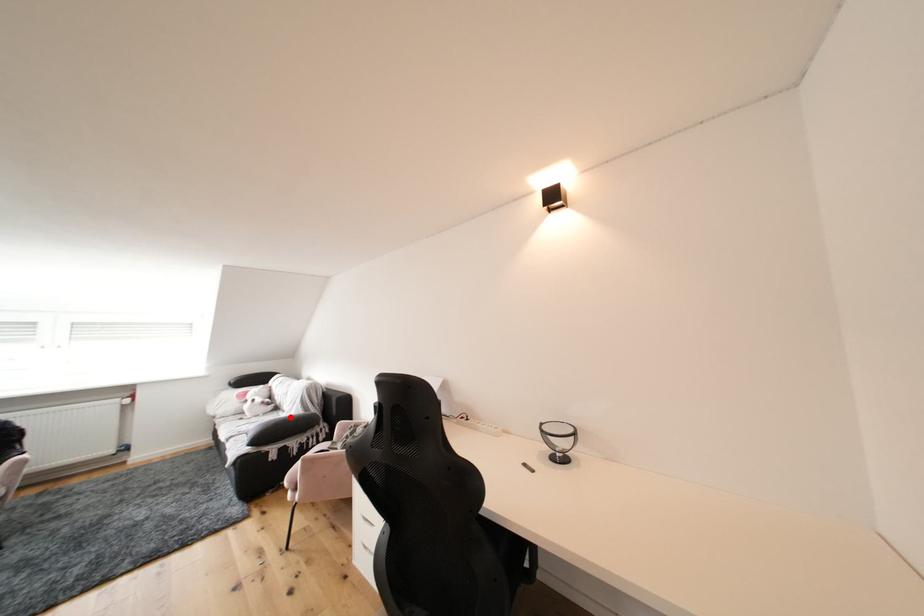
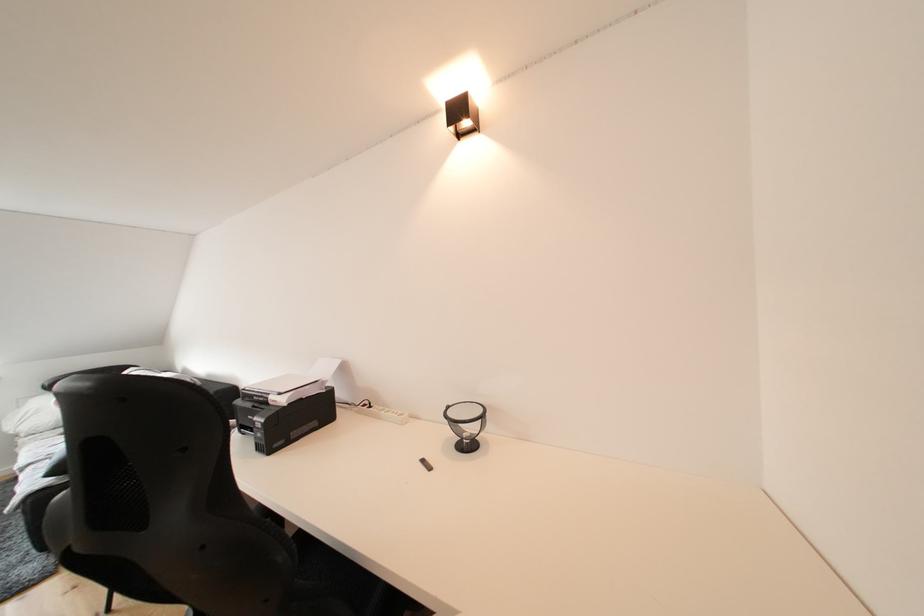
Question: I am providing you with two images of the same scene from different viewpoints. A red point is marked on the first image. At the location where the point appears in image 1, is it still visible in image 2?

Choices:
 (A) Yes
 (B) No

Answer: (B)